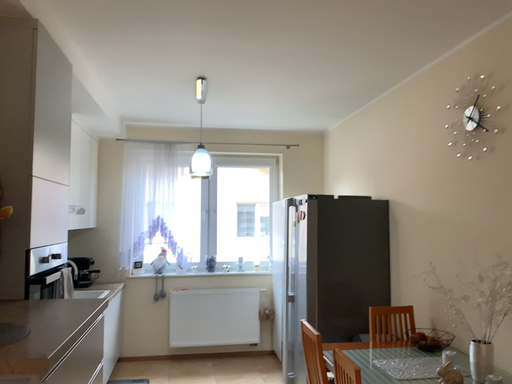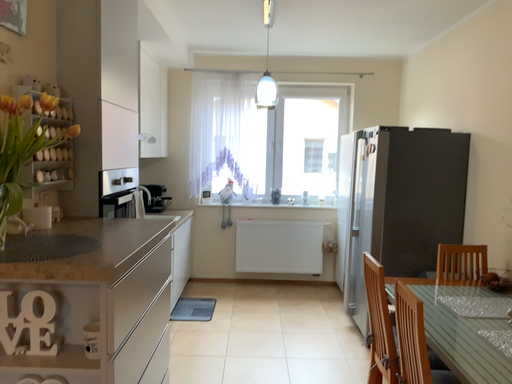
Question: How did the camera likely rotate when shooting the video?

Choices:
 (A) rotated upward
 (B) rotated downward

Answer: (B)